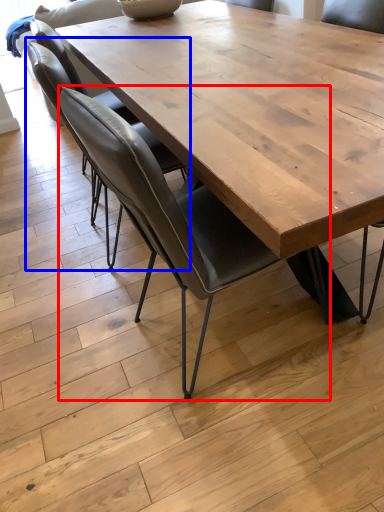
Question: Which object appears farthest to the camera in this image, chair (highlighted by a red box) or chair (highlighted by a blue box)?

Choices:
 (A) chair
 (B) chair

Answer: (B)